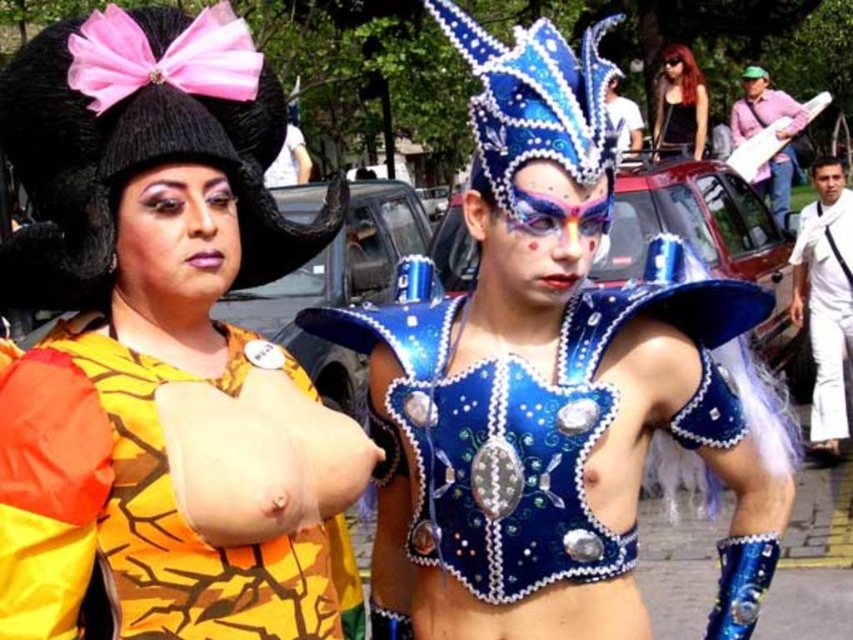
You are a photographer at a parade and want to capture both the black knitted hat with pink bow at upper left and the matte black car at upper center in a single photo. Based on their positions, which object should you focus on first to ensure both are in frame?

The black knitted hat with pink bow at upper left is to the left of the matte black car at upper center, so you should focus on the matte black car at upper center first to ensure both are in frame.

You are a photographer at a parade, and you need to capture a closeup of the white cotton shirt at right. Based on its position in the image, where should you focus your camera? Please provide coordinates as a point between 0 and 1 in both x and y axes.

The white cotton shirt at right is located at the 2D coordinates point [825,298], so you should focus your camera there.